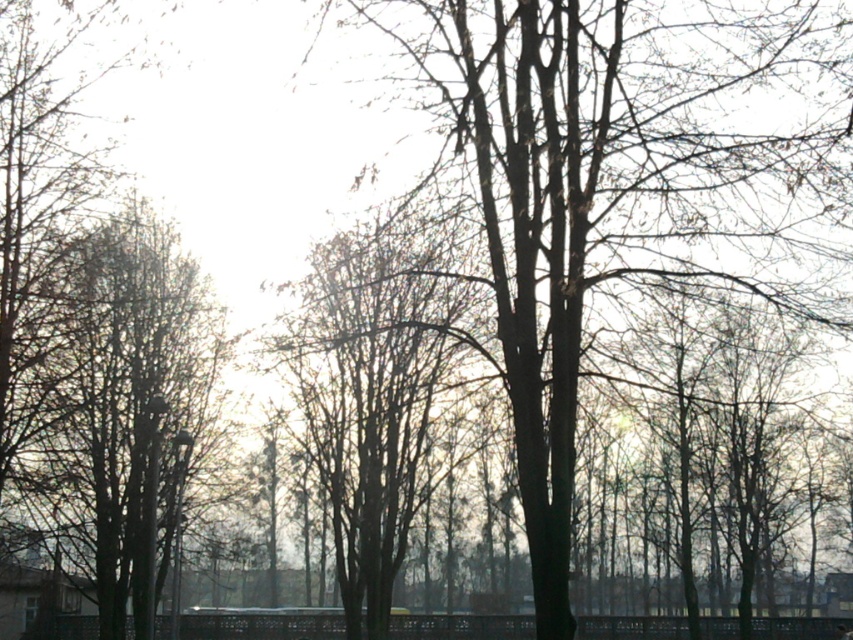
You are standing in the forest and see the smooth bark tree at center and the smooth brown tree at left. Which tree is positioned higher in the image?

The smooth bark tree at center is located above the smooth brown tree at left, so it is positioned higher in the image.